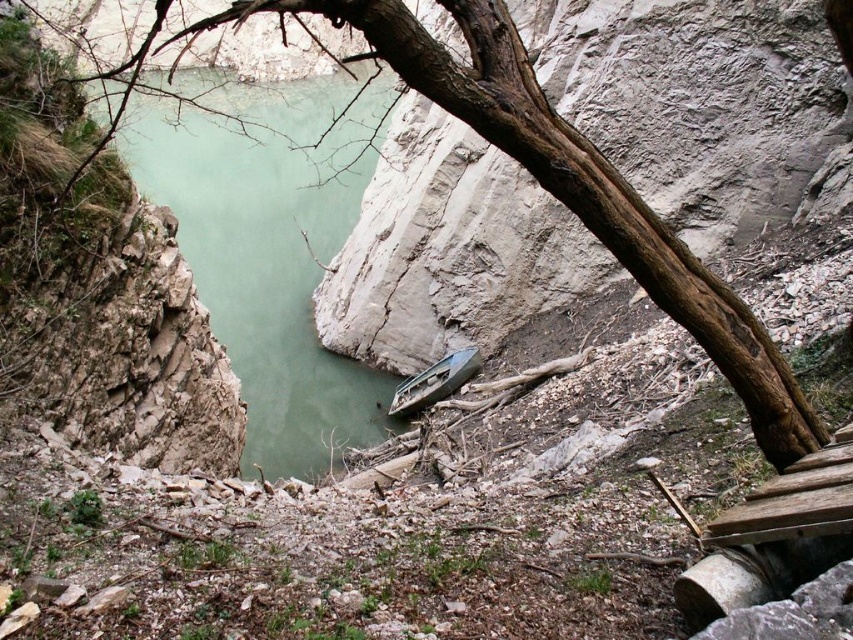
Is point (299, 156) in front of point (798, 448)?

That is False.

Who is higher up, green smooth water at center or brown rough tree trunk at upper center?

green smooth water at center is higher up.

Find the location of a particular element. The image size is (853, 640). green smooth water at center is located at coordinates (268, 243).

Is green smooth water at center thinner than green plastic boat at center?

In fact, green smooth water at center might be wider than green plastic boat at center.

Who is more distant from viewer, (x=328, y=104) or (x=477, y=362)?

The point (x=328, y=104) is more distant.

Locate an element on the screen. The width and height of the screenshot is (853, 640). green smooth water at center is located at coordinates (268, 243).

Where is `green smooth water at center`? The height and width of the screenshot is (640, 853). green smooth water at center is located at coordinates (268, 243).

Which is more to the left, brown rough tree trunk at upper center or green plastic boat at center?

From the viewer's perspective, brown rough tree trunk at upper center appears more on the left side.

Is brown rough tree trunk at upper center taller than green plastic boat at center?

Yes, brown rough tree trunk at upper center is taller than green plastic boat at center.

Is point (758, 384) in front of point (448, 392)?

That is True.

Find the location of `brown rough tree trunk at upper center`. brown rough tree trunk at upper center is located at coordinates (572, 188).